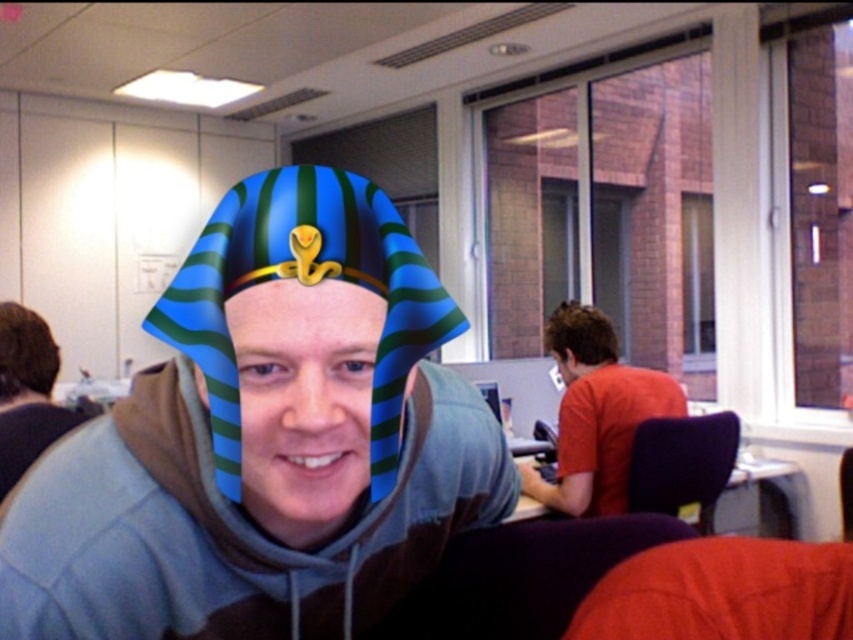
Question: Among these points, which one is nearest to the camera?

Choices:
 (A) (42, 378)
 (B) (403, 259)

Answer: (B)

Question: Does blue striped cloth at center have a larger size compared to brown hair at left?

Choices:
 (A) no
 (B) yes

Answer: (B)

Question: Does brown hair at left come in front of brown hair at right?

Choices:
 (A) yes
 (B) no

Answer: (A)

Question: Does blue striped cloth at center have a smaller size compared to brown hair at right?

Choices:
 (A) yes
 (B) no

Answer: (B)

Question: Among these points, which one is farthest from the camera?

Choices:
 (A) (376, 264)
 (B) (570, 340)
 (C) (18, 397)
 (D) (10, 444)

Answer: (B)

Question: Which point is closer to the camera?

Choices:
 (A) (227, 241)
 (B) (41, 323)
 (C) (567, 305)
 (D) (15, 422)

Answer: (A)